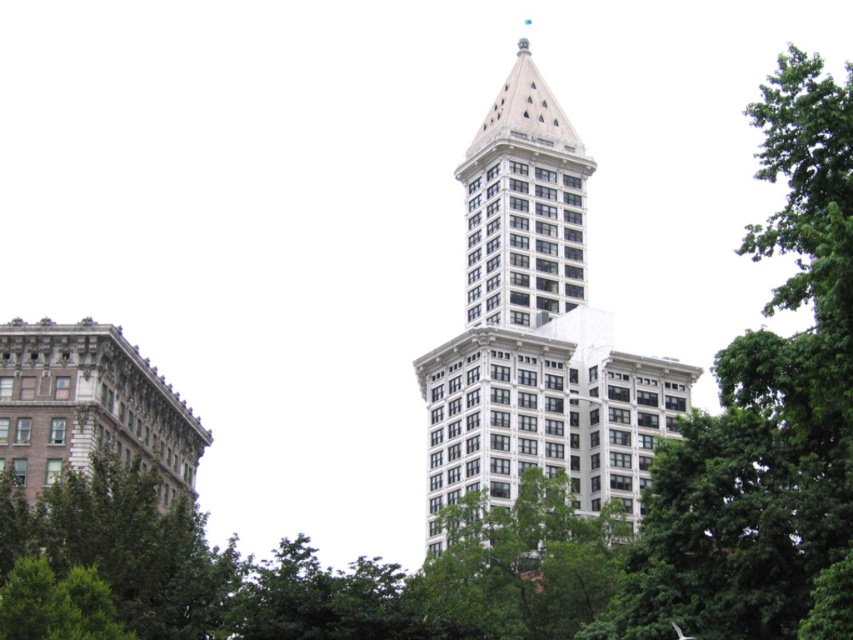
You are an architect analyzing the image of the skyscraper and its surroundings. Based on the scene, which object, the green leafy tree at upper right or the white stone building at center, has a greater height?

The green leafy tree at upper right is taller than the white stone building at center according to the description.

You are a construction worker planning to install a new antenna on the white stone building at center. The antenna requires a clear space of 150 feet in all directions to avoid interference with nearby objects. Based on the image, will the green leafy tree at upper right interfere with the antenna installation?

The green leafy tree at upper right is only 126.32 feet away from the white stone building at center, which is less than the required 150 feet clearance. Therefore, the tree will interfere with the antenna installation.